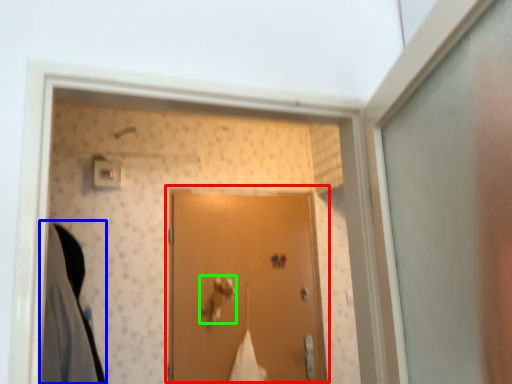
Question: Estimate the real-world distances between objects in this image. Which object is closer to door (highlighted by a red box), clothing (highlighted by a blue box) or door handle (highlighted by a green box)?

Choices:
 (A) clothing
 (B) door handle

Answer: (B)